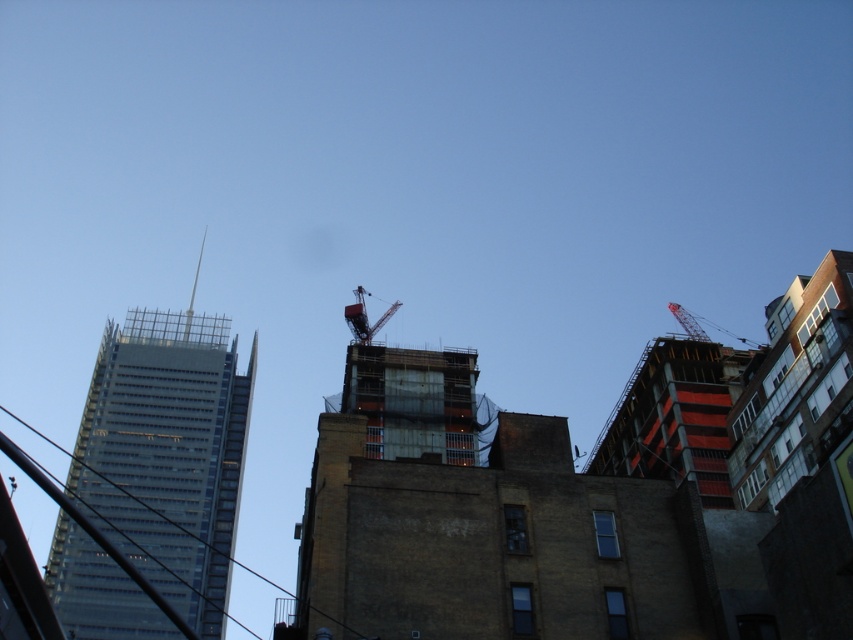
You are an architect analyzing the urban layout. Which object in the scene has a greater width when comparing the transparent glass skyscraper at upper left and the metallic red crane at center?

The transparent glass skyscraper at upper left has a greater width than the metallic red crane at center according to the description provided.

You are a construction inspector who needs to move from the metallic red crane at center to the metallic red crane at upper right. Given that your vehicle can only travel in straight lines and has a maximum range of 60 meters, can you reach the second crane without refueling?

The metallic red crane at center and metallic red crane at upper right are 61.67 meters apart. Since the vehicle has a maximum range of 60 meters, you cannot reach the second crane without refueling.

You are a construction inspector who needs to check the metallic red crane at center from the transparent glass skyscraper at upper left. Which direction should you move to reach the crane?

The transparent glass skyscraper at upper left is positioned on the left side of the metallic red crane at center, so you should move to the right to reach the crane.